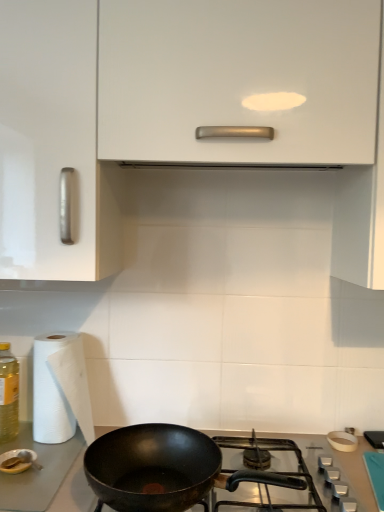
What is the approximate width of white paper at left?

The width of white paper at left is 5.25 inches.

Describe the element at coordinates (60, 389) in the screenshot. Image resolution: width=384 pixels, height=512 pixels. I see `white paper at left` at that location.

You are a GUI agent. You are given a task and a screenshot of the screen. Output one action in this format:
    pyautogui.click(x=<x>, y=<y>)
    Task: Click on the white glossy cabinet at upper center
    The height and width of the screenshot is (512, 384).
    Given the screenshot: What is the action you would take?
    pyautogui.click(x=186, y=116)

The height and width of the screenshot is (512, 384). What do you see at coordinates (186, 116) in the screenshot? I see `white glossy cabinet at upper center` at bounding box center [186, 116].

In order to face translucent yellow bottle at left, should I rotate leftwards or rightwards?

To face it directly, rotate left by 24.034 degrees.

What do you see at coordinates (8, 394) in the screenshot? Image resolution: width=384 pixels, height=512 pixels. I see `translucent yellow bottle at left` at bounding box center [8, 394].

In order to click on black matte pan at lower center in this screenshot , I will do `click(187, 469)`.

From the picture: Could you tell me if white glossy cabinet at upper center is facing white paper at left?

No, white glossy cabinet at upper center is not aimed at white paper at left.

From a real-world perspective, who is located lower, white glossy cabinet at upper center or white paper at left?

white paper at left is physically lower.

Does white glossy cabinet at upper center have a lesser height compared to white paper at left?

Incorrect, the height of white glossy cabinet at upper center does not fall short of that of white paper at left.

Considering the relative sizes of white paper at left and translucent yellow bottle at left in the image provided, is white paper at left wider than translucent yellow bottle at left?

Yes, white paper at left is wider than translucent yellow bottle at left.

Between point (68, 353) and point (16, 375), which one is positioned in front?

The point (68, 353) is more forward.

Is white paper at left inside or outside of translucent yellow bottle at left?

white paper at left is spatially situated outside translucent yellow bottle at left.

In terms of height, does translucent yellow bottle at left look taller or shorter compared to black matte pan at lower center?

translucent yellow bottle at left is taller than black matte pan at lower center.

Choose the correct answer: Is translucent yellow bottle at left inside black matte pan at lower center or outside it?

translucent yellow bottle at left is spatially situated outside black matte pan at lower center.

Do you think black matte pan at lower center is within translucent yellow bottle at left, or outside of it?

black matte pan at lower center is not enclosed by translucent yellow bottle at left.

Which of these two, black matte pan at lower center or translucent yellow bottle at left, is wider?

black matte pan at lower center.

In the scene shown: Is translucent yellow bottle at left at the back of black matte pan at lower center?

No, black matte pan at lower center is not facing the opposite direction of translucent yellow bottle at left.

Who is shorter, black matte pan at lower center or translucent yellow bottle at left?

With less height is black matte pan at lower center.

Who is more distant, white paper at left or white glossy cabinet at upper center?

white paper at left is further from the camera.

From the image's perspective, is white paper at left below white glossy cabinet at upper center?

Yes, from the image's perspective, white paper at left is below white glossy cabinet at upper center.

Considering the relative sizes of white paper at left and white glossy cabinet at upper center in the image provided, is white paper at left smaller than white glossy cabinet at upper center?

Yes.

Considering the relative sizes of white paper at left and white glossy cabinet at upper center in the image provided, is white paper at left taller than white glossy cabinet at upper center?

Incorrect, the height of white paper at left is not larger of that of white glossy cabinet at upper center.

I want to click on bottle on the left side of white glossy cabinet at upper center, so pyautogui.click(x=8, y=394).

From a real-world perspective, is white glossy cabinet at upper center physically below translucent yellow bottle at left?

No, from a real-world perspective, white glossy cabinet at upper center is not beneath translucent yellow bottle at left.

From the image's perspective, between white glossy cabinet at upper center and translucent yellow bottle at left, which one is located above?

white glossy cabinet at upper center.

Is white glossy cabinet at upper center positioned before translucent yellow bottle at left?

Yes, white glossy cabinet at upper center is in front of translucent yellow bottle at left.

Between white paper at left and black matte pan at lower center, which one has smaller size?

With smaller size is white paper at left.

Which of these two, white paper at left or black matte pan at lower center, is wider?

black matte pan at lower center is wider.

From a real-world perspective, which object rests below the other?

black matte pan at lower center.

Does white paper at left appear on the left side of black matte pan at lower center?

Yes, white paper at left is to the left of black matte pan at lower center.

Where is `paper towel below the white glossy cabinet at upper center (from the image's perspective)`? The height and width of the screenshot is (512, 384). paper towel below the white glossy cabinet at upper center (from the image's perspective) is located at coordinates (60, 389).

Locate an element on the screen. This screenshot has height=512, width=384. paper towel in front of the translucent yellow bottle at left is located at coordinates (60, 389).

Consider the image. From the image, which object appears to be nearer to white paper at left, black matte pan at lower center or translucent yellow bottle at left?

translucent yellow bottle at left.

Looking at the image, which one is located closer to black matte pan at lower center, translucent yellow bottle at left or white glossy cabinet at upper center?

translucent yellow bottle at left lies closer to black matte pan at lower center than the other object.

Estimate the real-world distances between objects in this image. Which object is closer to translucent yellow bottle at left, black matte pan at lower center or white paper at left?

Based on the image, white paper at left appears to be nearer to translucent yellow bottle at left.

Which object lies nearer to the anchor point translucent yellow bottle at left, white paper at left or black matte pan at lower center?

white paper at left is positioned closer to the anchor translucent yellow bottle at left.

Which object lies further to the anchor point translucent yellow bottle at left, white glossy cabinet at upper center or black matte pan at lower center?

white glossy cabinet at upper center is further to translucent yellow bottle at left.

Considering their positions, is white paper at left positioned further to translucent yellow bottle at left than white glossy cabinet at upper center?

white glossy cabinet at upper center.

From the image, which object appears to be farther from white paper at left, translucent yellow bottle at left or black matte pan at lower center?

black matte pan at lower center is further to white paper at left.

Looking at this image, estimate the real-world distances between objects in this image. Which object is closer to white glossy cabinet at upper center, black matte pan at lower center or translucent yellow bottle at left?

black matte pan at lower center is closer to white glossy cabinet at upper center.

This screenshot has width=384, height=512. In order to click on paper towel between translucent yellow bottle at left and black matte pan at lower center in this screenshot , I will do `click(60, 389)`.

The height and width of the screenshot is (512, 384). I want to click on paper towel that lies between white glossy cabinet at upper center and black matte pan at lower center from top to bottom, so click(60, 389).

At what (x,y) coordinates should I click in order to perform the action: click on bottle between white glossy cabinet at upper center and white paper at left in the up-down direction. Please return your answer as a coordinate pair (x, y). Image resolution: width=384 pixels, height=512 pixels. Looking at the image, I should click on (8, 394).

What are the coordinates of `bottle between white glossy cabinet at upper center and black matte pan at lower center in the up-down direction` in the screenshot? It's located at (8, 394).